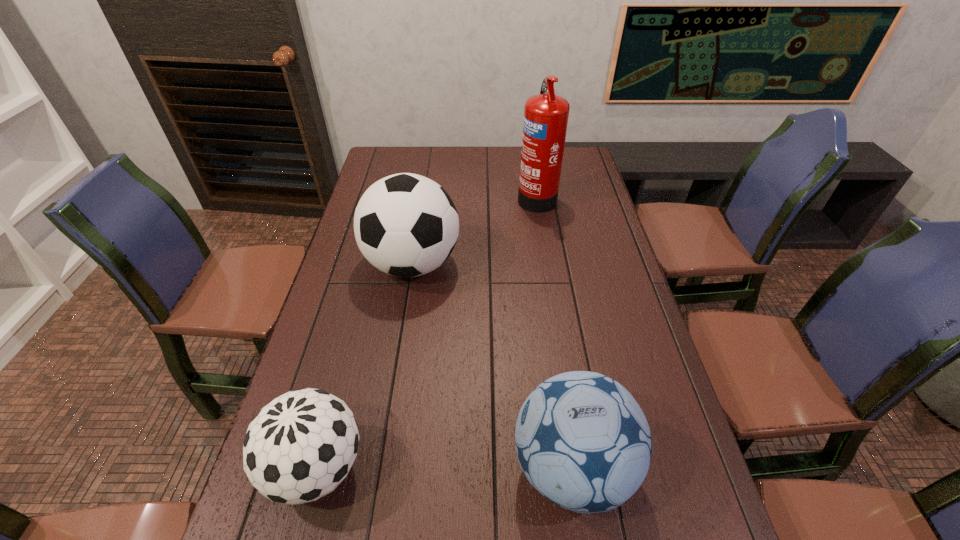
The width and height of the screenshot is (960, 540). Find the location of `free spot located 0.380m on the front of the farthest soccer ball`. free spot located 0.380m on the front of the farthest soccer ball is located at coordinates (387, 423).

Where is `free space located on the side with brand of the second tallest soccer ball`? This screenshot has height=540, width=960. free space located on the side with brand of the second tallest soccer ball is located at coordinates (352, 467).

Find the location of a particular element. This screenshot has height=540, width=960. vacant region located on the side with brand of the second tallest soccer ball is located at coordinates coord(416,467).

At what (x,y) coordinates should I click in order to perform the action: click on free space located 0.240m on the side with brand of the second tallest soccer ball. Please return your answer as a coordinate pair (x, y). The image size is (960, 540). Looking at the image, I should click on (396, 467).

The width and height of the screenshot is (960, 540). What are the coordinates of `vacant region located on the right of the shortest soccer ball` in the screenshot? It's located at (520, 468).

In order to click on fire extinguisher that is at the right edge in this screenshot , I will do `click(546, 115)`.

In order to click on soccer ball at the right edge in this screenshot , I will do `click(583, 442)`.

Where is `vacant area at the far edge of the desktop`? vacant area at the far edge of the desktop is located at coordinates (495, 159).

The width and height of the screenshot is (960, 540). In the image, there is a desktop. In order to click on vacant space at the left edge in this screenshot , I will do `click(355, 271)`.

You are a GUI agent. You are given a task and a screenshot of the screen. Output one action in this format:
    pyautogui.click(x=<x>, y=<y>)
    Task: Click on the vacant region at the right edge of the desktop
    This screenshot has height=540, width=960.
    Given the screenshot: What is the action you would take?
    pyautogui.click(x=632, y=305)